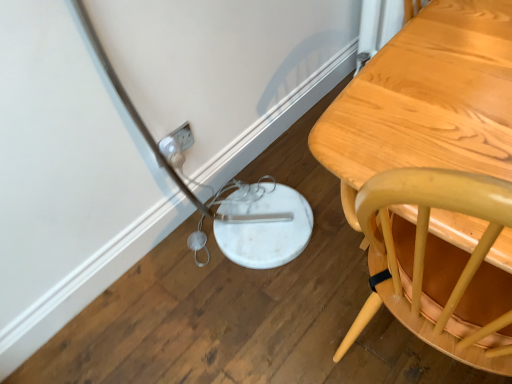
Locate an element on the screen. The width and height of the screenshot is (512, 384). light brown wooden table at right is located at coordinates (429, 163).

What do you see at coordinates (429, 163) in the screenshot? The height and width of the screenshot is (384, 512). I see `light brown wooden table at right` at bounding box center [429, 163].

What do you see at coordinates (183, 136) in the screenshot? This screenshot has height=384, width=512. I see `white plastic plug at lower left` at bounding box center [183, 136].

Find the location of a particular element. white plastic plug at lower left is located at coordinates (183, 136).

Find the location of a particular element. light brown wooden table at right is located at coordinates [x=429, y=163].

Would you say light brown wooden table at right is to the left or to the right of white plastic plug at lower left in the picture?

light brown wooden table at right is positioned on white plastic plug at lower left's right side.

Is light brown wooden table at right further to camera compared to white plastic plug at lower left?

No, light brown wooden table at right is in front of white plastic plug at lower left.

Is point (402, 37) behind point (173, 135)?

That is False.

From the image's perspective, is light brown wooden table at right over white plastic plug at lower left?

Incorrect, from the image's perspective, light brown wooden table at right is lower than white plastic plug at lower left.

From a real-world perspective, is light brown wooden table at right located higher than white plastic plug at lower left?

Result: Indeed, from a real-world perspective, light brown wooden table at right stands above white plastic plug at lower left.

Which object is wider, light brown wooden table at right or white plastic plug at lower left?

light brown wooden table at right.

Considering the sizes of light brown wooden table at right and white plastic plug at lower left in the image, is light brown wooden table at right taller or shorter than white plastic plug at lower left?

In the image, light brown wooden table at right appears to be taller than white plastic plug at lower left.

Considering the sizes of objects light brown wooden table at right and white plastic plug at lower left in the image provided, who is smaller, light brown wooden table at right or white plastic plug at lower left?

With smaller size is white plastic plug at lower left.

Which is correct: light brown wooden table at right is inside white plastic plug at lower left, or outside of it?

light brown wooden table at right is located beyond the bounds of white plastic plug at lower left.

Are light brown wooden table at right and white plastic plug at lower left making contact?

No, light brown wooden table at right is not making contact with white plastic plug at lower left.

Does light brown wooden table at right turn towards white plastic plug at lower left?

No, light brown wooden table at right does not turn towards white plastic plug at lower left.

How distant is light brown wooden table at right from white plastic plug at lower left?

light brown wooden table at right is 32.70 inches from white plastic plug at lower left.

This screenshot has width=512, height=384. Find the location of `electric outlet behind the light brown wooden table at right`. electric outlet behind the light brown wooden table at right is located at coordinates (x=183, y=136).

Considering the positions of objects white plastic plug at lower left and light brown wooden table at right in the image provided, who is more to the left, white plastic plug at lower left or light brown wooden table at right?

white plastic plug at lower left is more to the left.

Is white plastic plug at lower left positioned in front of light brown wooden table at right?

No, it is not.

Between point (179, 143) and point (409, 230), which one is positioned in front?

The point (409, 230) is in front.

From the image's perspective, which object appears higher, white plastic plug at lower left or light brown wooden table at right?

white plastic plug at lower left.

Based on the photo, from a real-world perspective, is white plastic plug at lower left physically located above or below light brown wooden table at right?

In terms of real-world spatial position, white plastic plug at lower left is below light brown wooden table at right.

Which object is thinner, white plastic plug at lower left or light brown wooden table at right?

With smaller width is white plastic plug at lower left.

In terms of height, does white plastic plug at lower left look taller or shorter compared to light brown wooden table at right?

Clearly, white plastic plug at lower left is shorter compared to light brown wooden table at right.

In terms of size, does white plastic plug at lower left appear bigger or smaller than light brown wooden table at right?

In the image, white plastic plug at lower left appears to be smaller than light brown wooden table at right.

Which is correct: white plastic plug at lower left is inside light brown wooden table at right, or outside of it?

white plastic plug at lower left is located beyond the bounds of light brown wooden table at right.

Is white plastic plug at lower left with light brown wooden table at right?

No, white plastic plug at lower left is not with light brown wooden table at right.

Is white plastic plug at lower left looking in the opposite direction of light brown wooden table at right?

No, white plastic plug at lower left is not facing the opposite direction of light brown wooden table at right.

Identify the location of table in front of the white plastic plug at lower left. [429, 163].

The image size is (512, 384). Find the location of `table on the right of the white plastic plug at lower left`. table on the right of the white plastic plug at lower left is located at coordinates (429, 163).

The image size is (512, 384). I want to click on electric outlet that is behind the light brown wooden table at right, so click(x=183, y=136).